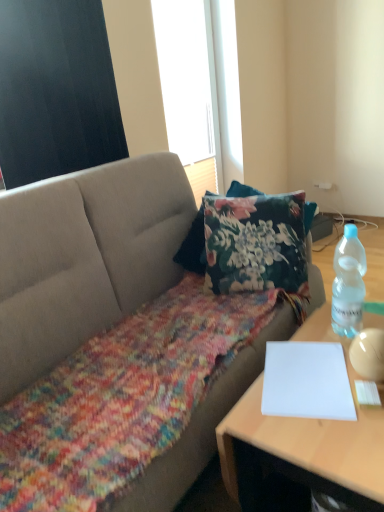
Locate an element on the screen. vacant space situated above white paper at right (from a real-world perspective) is located at coordinates (316, 385).